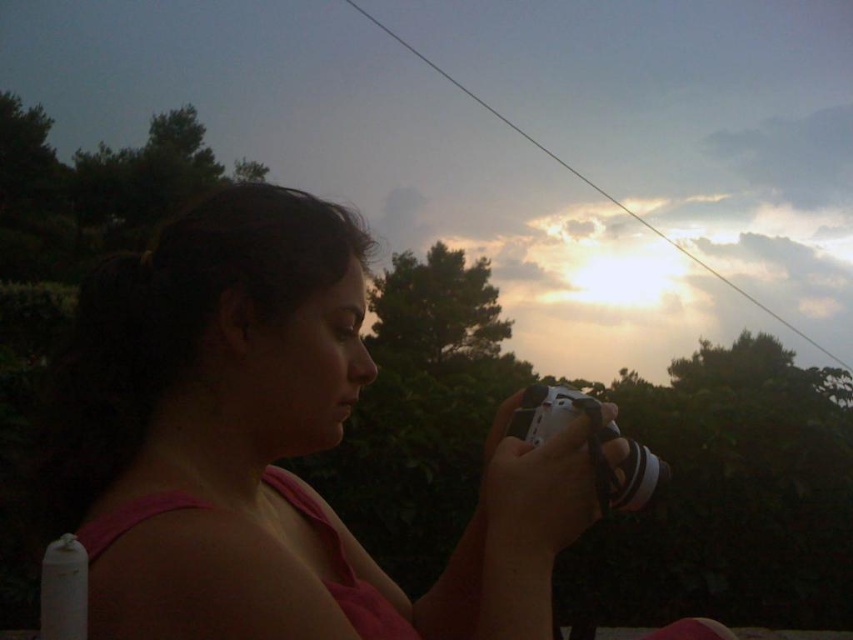
Consider the image. You are a photographer trying to frame a shot. You have a pink fabric at center and a white plastic camera at center in your viewfinder. Which object should you focus on to ensure it takes up more space in your photo?

The pink fabric at center has a larger size compared to the white plastic camera at center, so focusing on the pink fabric at center will ensure it takes up more space in your photo.

You are a photographer trying to capture the perfect shot. You notice the pink fabric at center and the camera in your hands. How far apart are these two items from each other?

The pink fabric at center and the camera are 19.49 inches apart from each other.

You are a photographer trying to frame a shot. You have a pink fabric at center and a white plastic camera at center in your viewfinder. Which object will appear wider in the photo?

The pink fabric at center will appear wider in the photo because its width is larger than the white plastic camera at center.